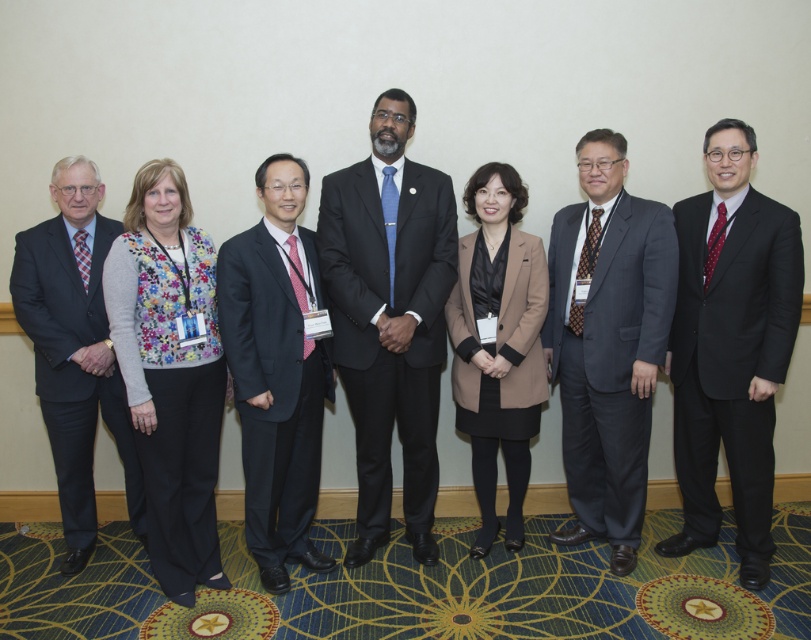
You are organizing a photo shoot and need to ensure there is enough space between the matte black suit at center and the dark gray suit at left for a photographer to move comfortably. The photographer requires at least 1.2 meters of space between subjects. Based on the image, is the current distance sufficient?

The matte black suit at center is 1.18 meters from the dark gray suit at left, which is slightly less than the required 1.2 meters. Therefore, the current distance is insufficient for the photographer to move comfortably.